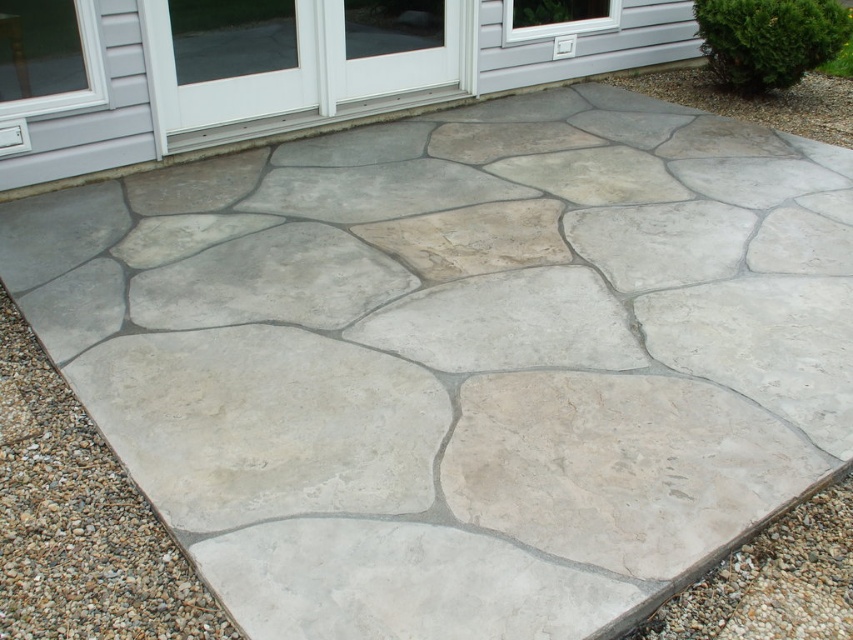
Is gray gravel at lower left positioned at the back of gray gravel at bottom right?

No, it is in front of gray gravel at bottom right.

Which is below, gray gravel at lower left or gray gravel at bottom right?

gray gravel at bottom right

Is point (157, 579) closer to camera compared to point (787, 512)?

That is True.

Find the location of `gray gravel at lower left`. gray gravel at lower left is located at coordinates coord(79,520).